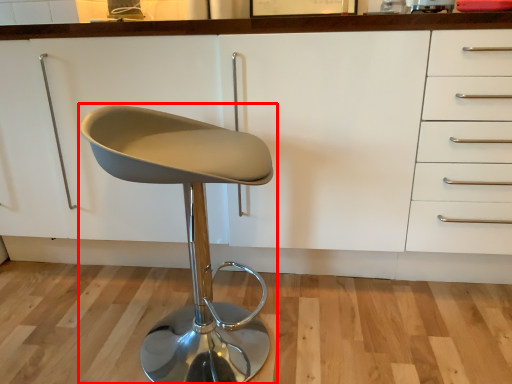
Question: From the image's perspective, where is chair (annotated by the red box) located in relation to cabinetry in the image?

Choices:
 (A) below
 (B) above

Answer: (A)